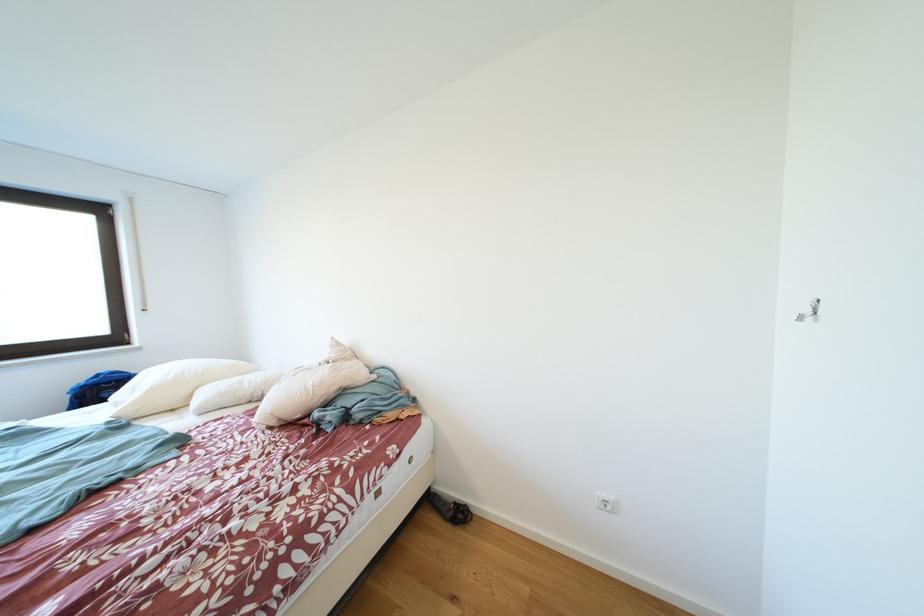
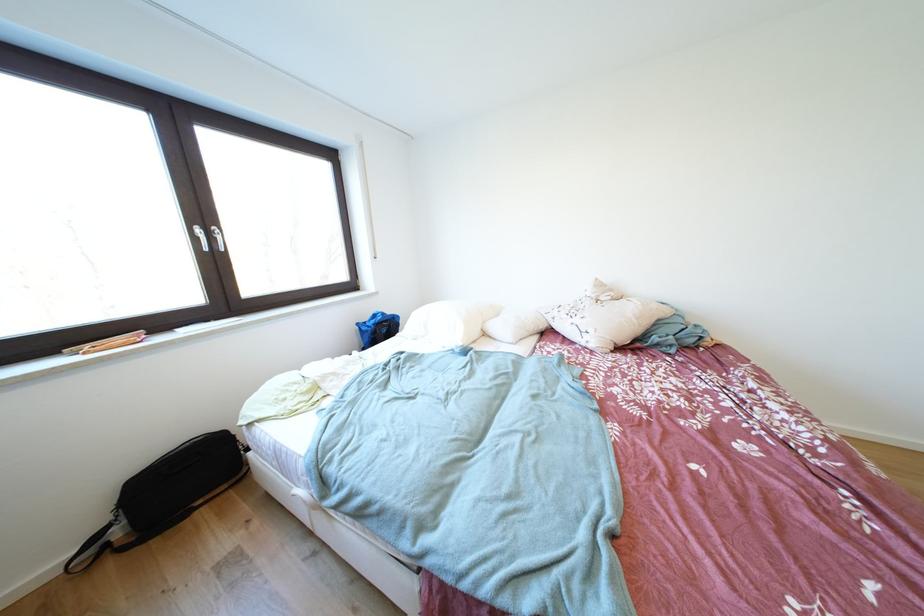
Where in the second image is the point corresponding to [341,342] from the first image?

(604, 284)